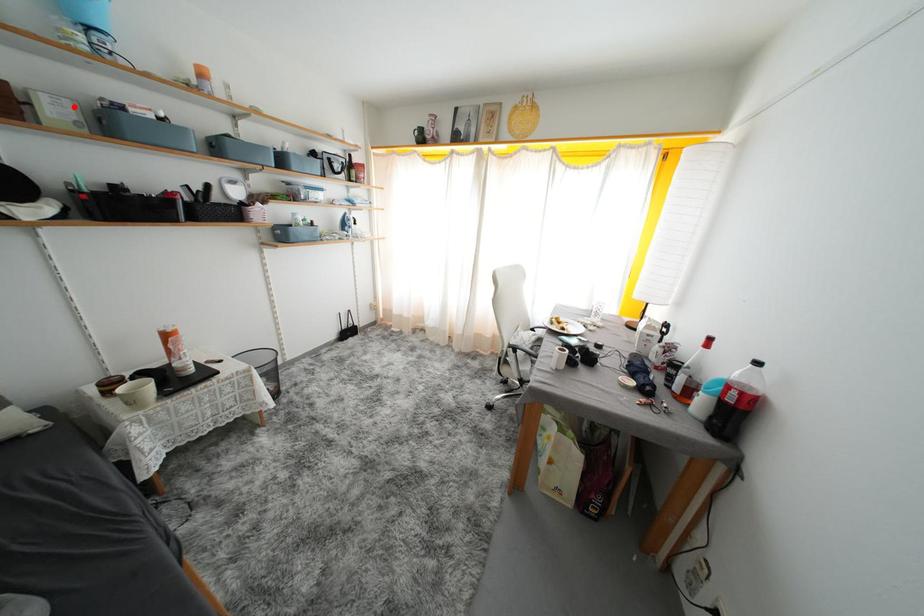
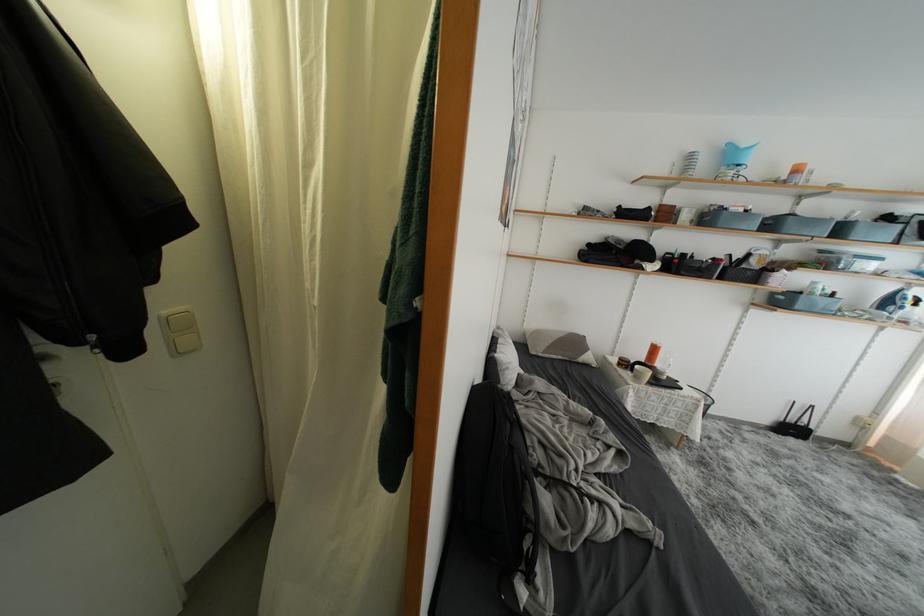
Question: I am providing you with two images of the same scene from different viewpoints. Given a red point in image1, look at the same physical point in image2. Is it:

Choices:
 (A) Closer to the viewpoint
 (B) Farther from the viewpoint

Answer: (A)